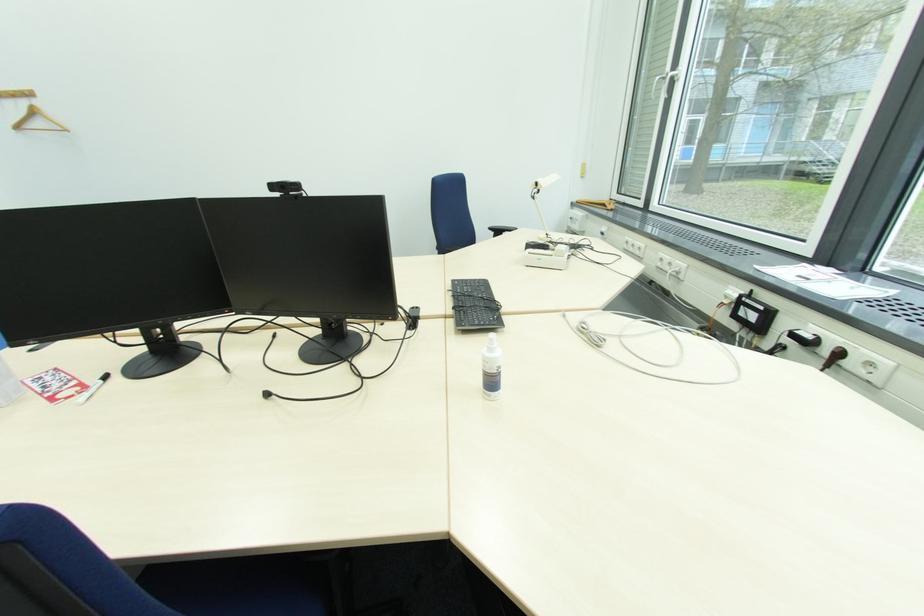
Where is `blue chair sitting surface`? blue chair sitting surface is located at coordinates (494, 281).